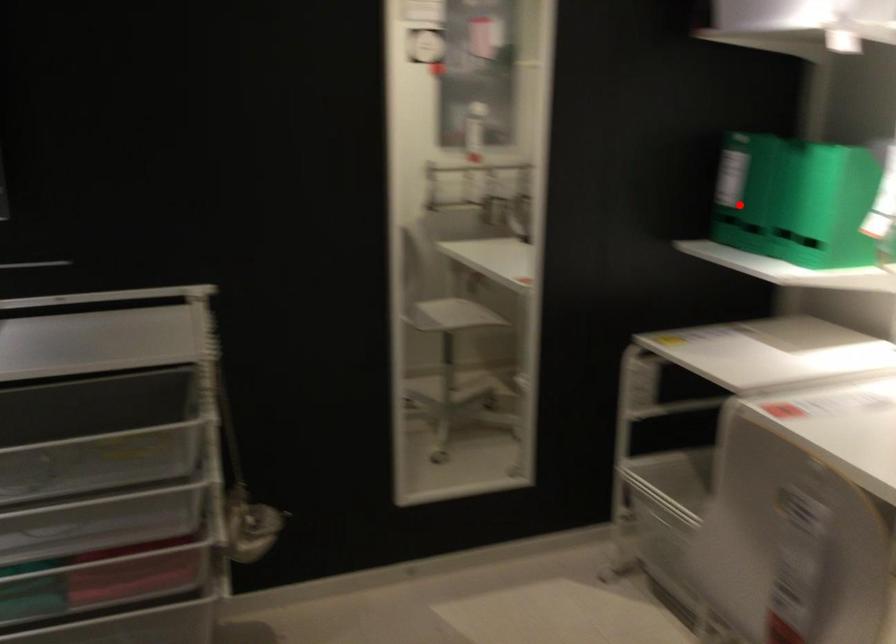
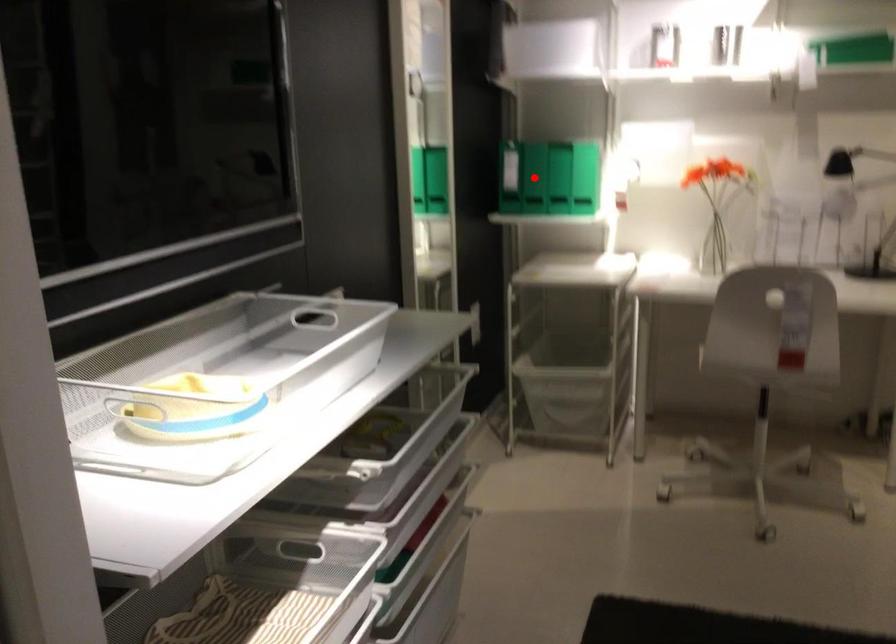
I am providing you with two images of the same scene from different viewpoints. A red point is marked on the first image and another point is marked on the second image. Are the points marked in image1 and image2 representing the same 3D position?

Yes